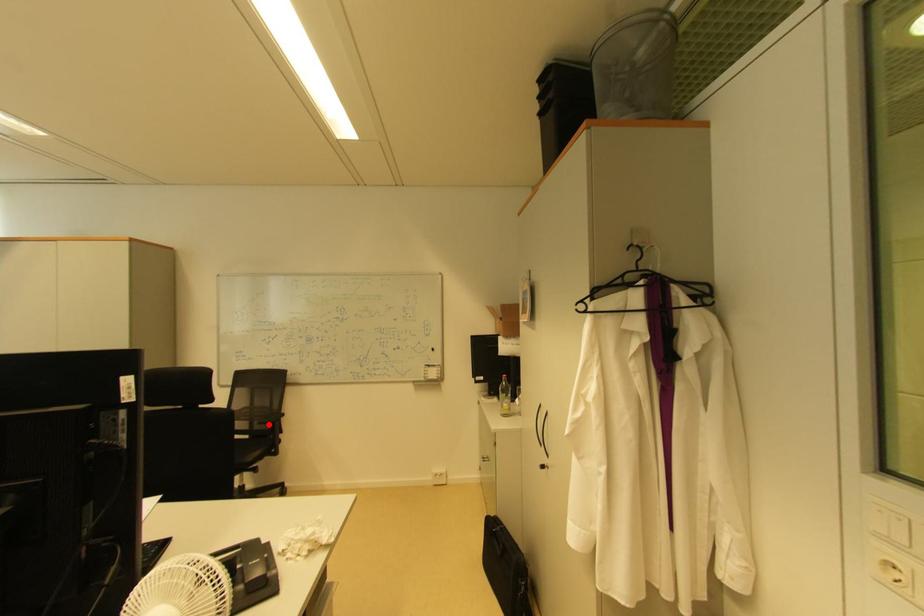
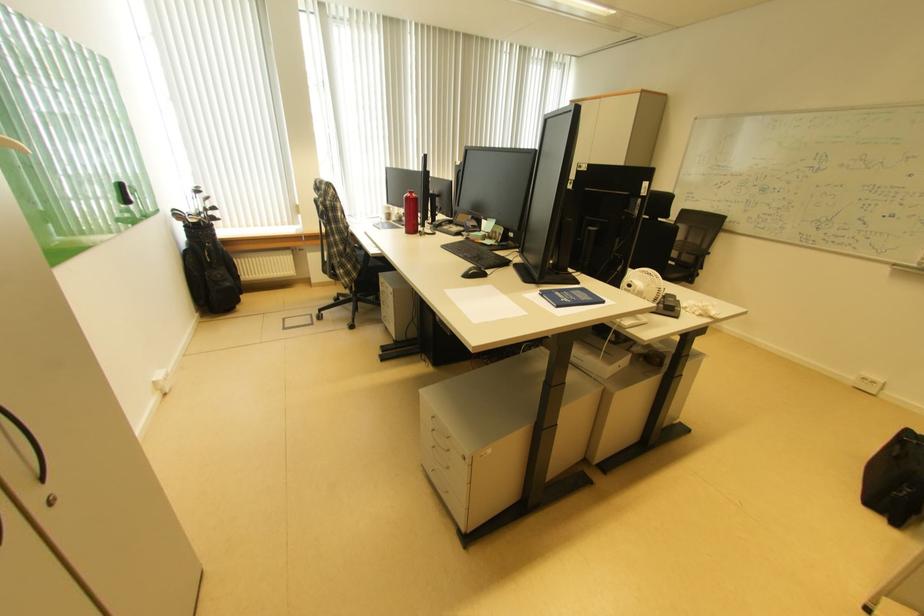
Where in the second image is the point corresponding to the highlighted location from the first image?

(697, 254)